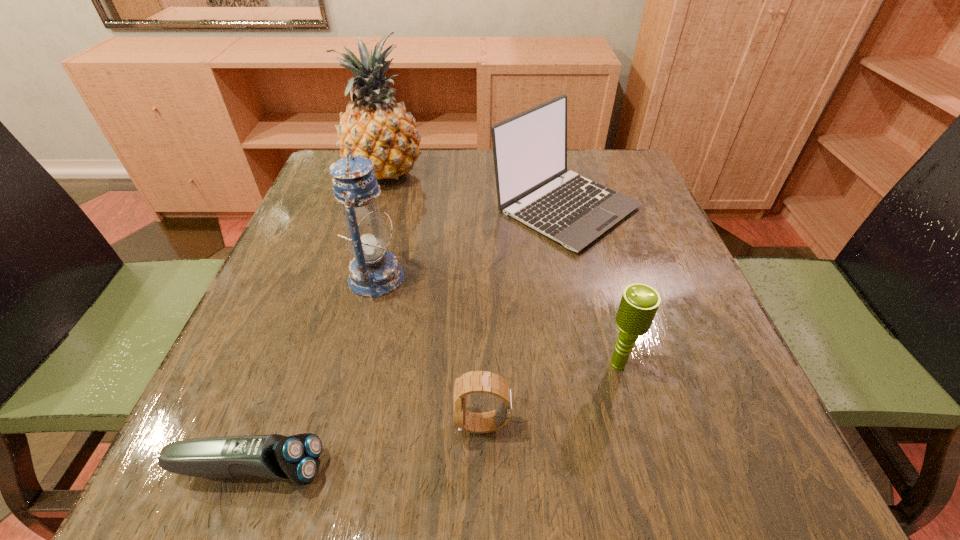
Where is `vacant area at the near edge`? vacant area at the near edge is located at coordinates (648, 482).

Where is `free spot at the left edge of the desktop`? free spot at the left edge of the desktop is located at coordinates (335, 332).

The image size is (960, 540). In the image, there is a desktop. What are the coordinates of `blank space at the right edge` in the screenshot? It's located at (x=637, y=250).

You are a GUI agent. You are given a task and a screenshot of the screen. Output one action in this format:
    pyautogui.click(x=<x>, y=<y>)
    Task: Click on the vacant point at the far left corner
    
    Given the screenshot: What is the action you would take?
    tap(309, 192)

The width and height of the screenshot is (960, 540). In order to click on vacant space at the near left corner of the desktop in this screenshot , I will do `click(219, 485)`.

Image resolution: width=960 pixels, height=540 pixels. In the image, there is a desktop. Identify the location of vacant space at the far right corner. (635, 160).

This screenshot has height=540, width=960. I want to click on free space at the near right corner of the desktop, so click(681, 492).

Image resolution: width=960 pixels, height=540 pixels. In order to click on empty location between the laptop_computer and the fourth tallest object in this screenshot , I will do `click(591, 286)`.

At what (x,y) coordinates should I click in order to perform the action: click on free space between the second nearest object and the pineapple. Please return your answer as a coordinate pair (x, y). Looking at the image, I should click on (434, 298).

In order to click on vacant region between the laptop_computer and the pineapple in this screenshot , I will do `click(475, 190)`.